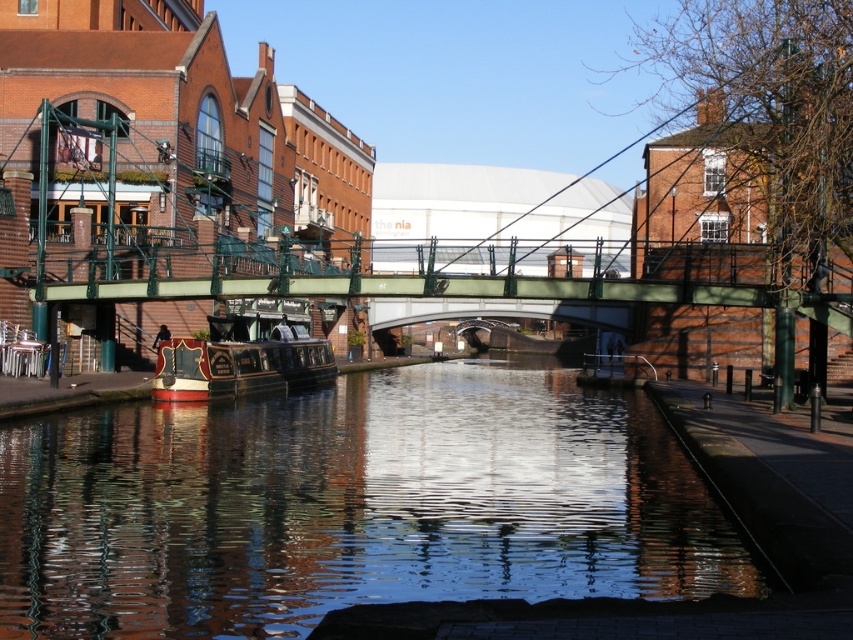
Can you confirm if smooth reflective water at center is smaller than polished wood boat at left?

Correct, smooth reflective water at center occupies less space than polished wood boat at left.

Does smooth reflective water at center appear on the right side of polished wood boat at left?

Yes, smooth reflective water at center is to the right of polished wood boat at left.

Does point (120, 564) lie behind point (229, 381)?

That is False.

What are the coordinates of `smooth reflective water at center` in the screenshot? It's located at (351, 504).